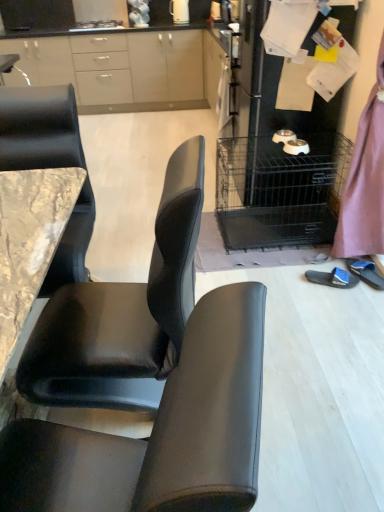
Question: Should I look upward or downward to see white glossy electric kettle at upper center?

Choices:
 (A) down
 (B) up

Answer: (B)

Question: From a real-world perspective, does blue fabric slipper at lower right, marked as the 1th footwear in a left-to-right arrangement, sit lower than black leather chair at center?

Choices:
 (A) yes
 (B) no

Answer: (A)

Question: Is blue fabric slipper at lower right, marked as the 1th footwear in a left-to-right arrangement, in front of black leather chair at center?

Choices:
 (A) yes
 (B) no

Answer: (B)

Question: Would you consider blue fabric slipper at lower right, marked as the 1th footwear in a left-to-right arrangement, to be distant from black leather chair at center?

Choices:
 (A) yes
 (B) no

Answer: (A)

Question: Is blue fabric slipper at lower right, arranged as the second footwear when viewed from the right, looking in the opposite direction of black leather chair at center?

Choices:
 (A) no
 (B) yes

Answer: (A)

Question: Does blue fabric slipper at lower right, arranged as the second footwear when viewed from the right, have a greater height compared to black leather chair at center?

Choices:
 (A) no
 (B) yes

Answer: (A)

Question: Does blue fabric slipper at lower right, marked as the 1th footwear in a left-to-right arrangement, have a lesser height compared to black leather chair at center?

Choices:
 (A) yes
 (B) no

Answer: (A)

Question: Is metallic silver pet bowls at right placed right next to blue fabric slipper at lower right, which is the first footwear from right to left?

Choices:
 (A) no
 (B) yes

Answer: (A)

Question: Can you confirm if metallic silver pet bowls at right is thinner than blue fabric slipper at lower right, which is the first footwear from right to left?

Choices:
 (A) yes
 (B) no

Answer: (B)

Question: Is the depth of metallic silver pet bowls at right less than that of blue fabric slipper at lower right, which is the first footwear from right to left?

Choices:
 (A) yes
 (B) no

Answer: (B)

Question: Can you confirm if metallic silver pet bowls at right is wider than blue fabric slipper at lower right, the 2th footwear viewed from the left?

Choices:
 (A) no
 (B) yes

Answer: (B)

Question: Is metallic silver pet bowls at right aimed at blue fabric slipper at lower right, the 2th footwear viewed from the left?

Choices:
 (A) yes
 (B) no

Answer: (B)

Question: Is metallic silver pet bowls at right to the left of blue fabric slipper at lower right, the 2th footwear viewed from the left, from the viewer's perspective?

Choices:
 (A) yes
 (B) no

Answer: (A)

Question: Is blue fabric slipper at lower right, which is the first footwear from right to left, positioned with its back to matte white cabinets at upper left?

Choices:
 (A) yes
 (B) no

Answer: (B)